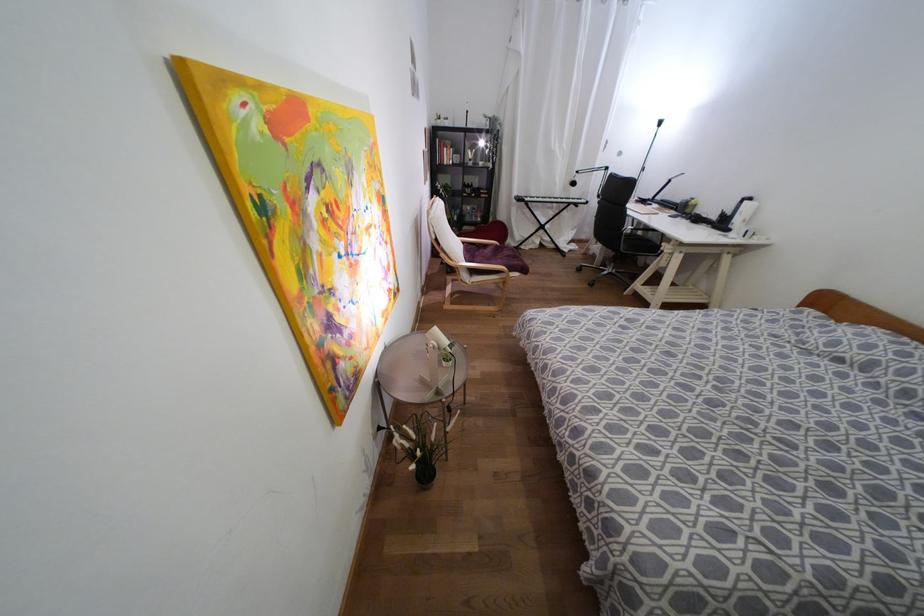
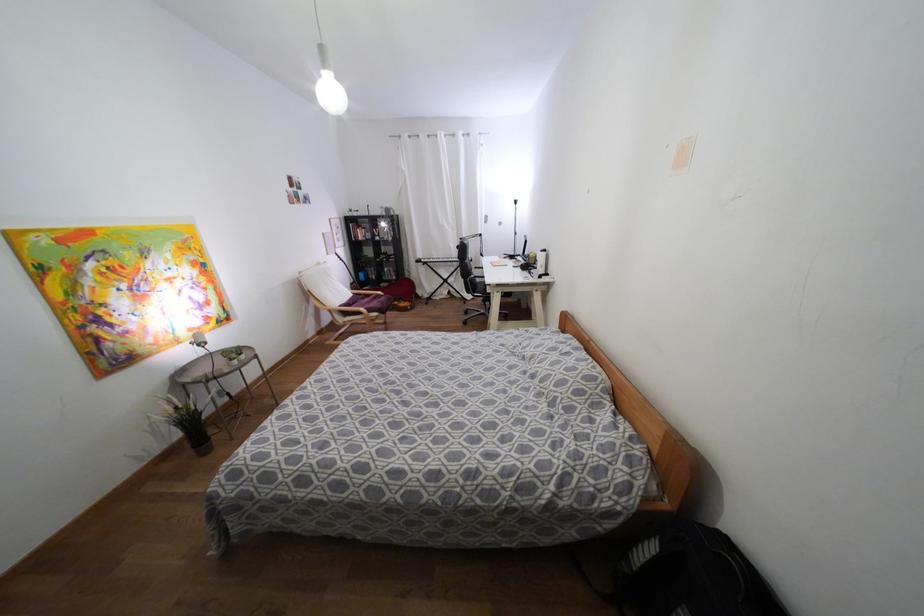
In the second image, find the point that corresponds to (x=472, y=270) in the first image.

(344, 313)